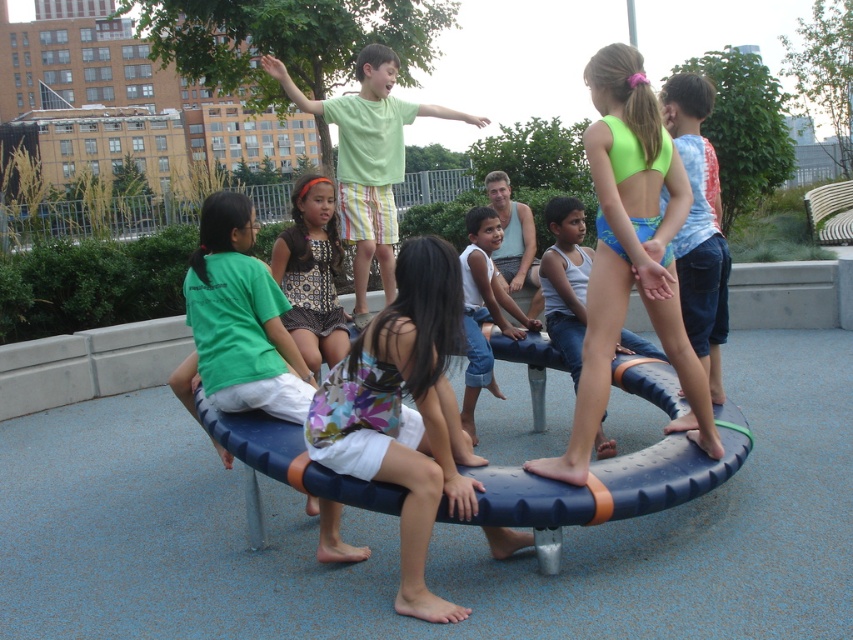
You are a photographer trying to capture both the floral fabric dress at center and the green matte shirt at upper center in a single shot. Which object should you focus on first to ensure both are in frame?

The floral fabric dress at center is smaller than the green matte shirt at upper center, so you should focus on the green matte shirt at upper center first to ensure both are in frame.

Looking at this image, you are a parent trying to ensure safety between the two children. The safety rule states that children must stay at least 2 meters apart. Are the floral fabric dress at center and green matte shirt at upper center following the safety rule?

The floral fabric dress at center is 2.27 meters away from the green matte shirt at upper center. Since 2.27 meters is more than the required 2 meters, they are following the safety rule.